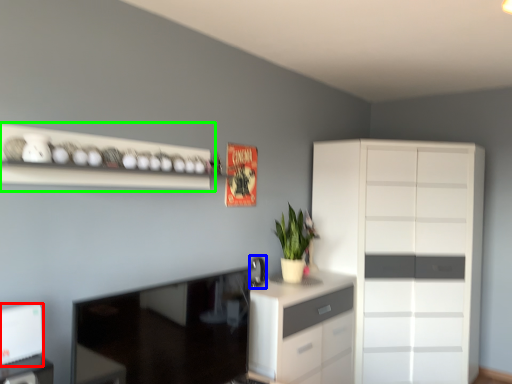
Question: Which is farther away from appliance (highlighted by a red box)? appliance (highlighted by a blue box) or shelf (highlighted by a green box)?

Choices:
 (A) appliance
 (B) shelf

Answer: (A)